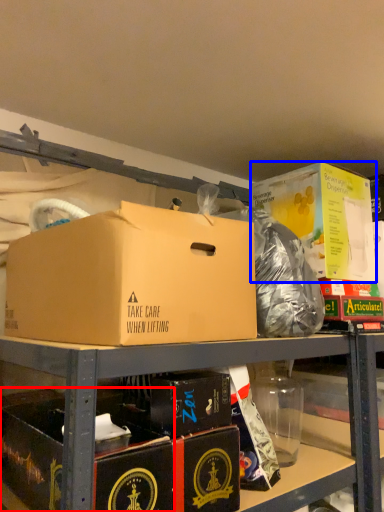
Question: Which of the following is the closest to the observer, box (highlighted by a red box) or box (highlighted by a blue box)?

Choices:
 (A) box
 (B) box

Answer: (A)